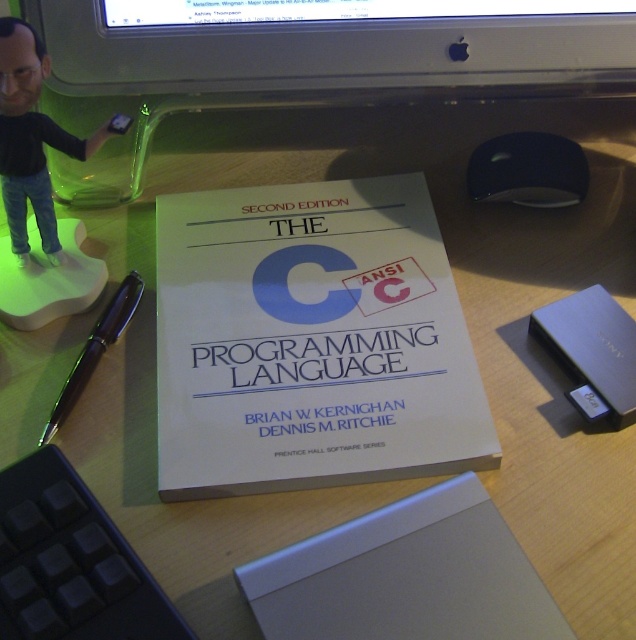
Measure the distance between black plastic keyboard at lower left and camera.

The distance of black plastic keyboard at lower left from camera is 14.79 inches.

Is point (8, 483) farther from viewer compared to point (130, 301)?

No, (8, 483) is closer to viewer.

Who is more distant from viewer, (x=83, y=512) or (x=128, y=296)?

Point (x=128, y=296)

This screenshot has width=636, height=640. I want to click on black plastic keyboard at lower left, so click(71, 563).

Between point (174, 67) and point (36, 568), which one is positioned behind?

The point (174, 67) is more distant.

Is silver plastic computer monitor at upper center closer to the viewer compared to black plastic keyboard at lower left?

No, silver plastic computer monitor at upper center is behind black plastic keyboard at lower left.

Is point (551, 76) in front of point (83, 499)?

No, it is behind (83, 499).

Image resolution: width=636 pixels, height=640 pixels. I want to click on silver plastic computer monitor at upper center, so click(x=329, y=44).

Does silver plastic computer monitor at upper center have a greater height compared to silver metallic laptop at center?

No.

Can you confirm if silver plastic computer monitor at upper center is shorter than silver metallic laptop at center?

Indeed, silver plastic computer monitor at upper center has a lesser height compared to silver metallic laptop at center.

Between point (565, 1) and point (300, 573), which one is positioned behind?

Point (565, 1)

Where is `silver plastic computer monitor at upper center`? silver plastic computer monitor at upper center is located at coordinates (329, 44).